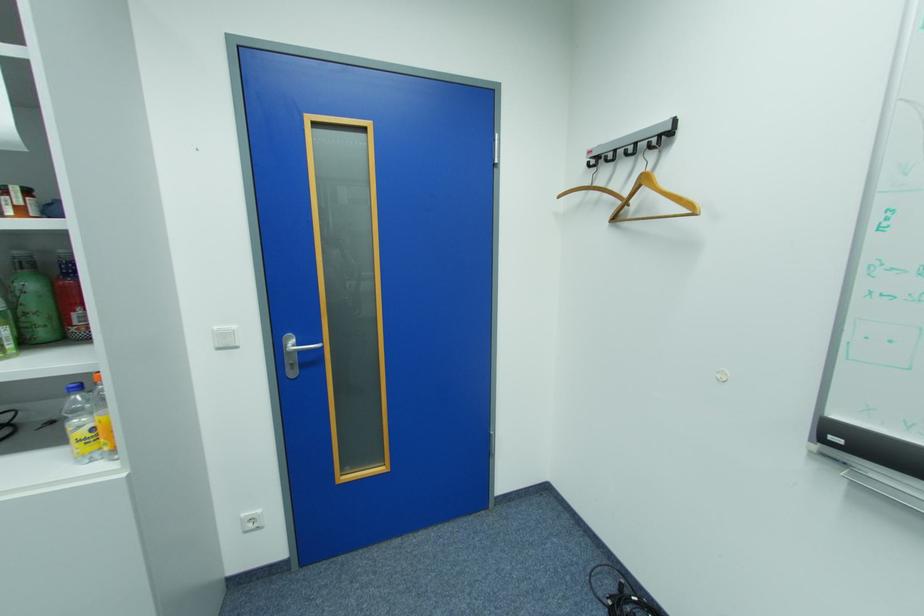
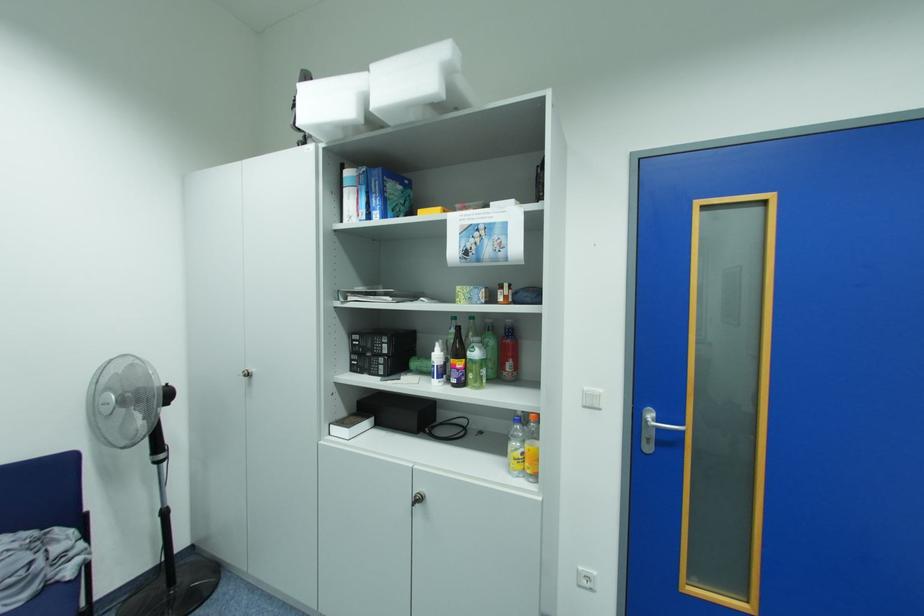
Question: The images are taken continuously from a first-person perspective. In which direction is your viewpoint rotating?

Choices:
 (A) Left
 (B) Right
 (C) Up
 (D) Down

Answer: (A)